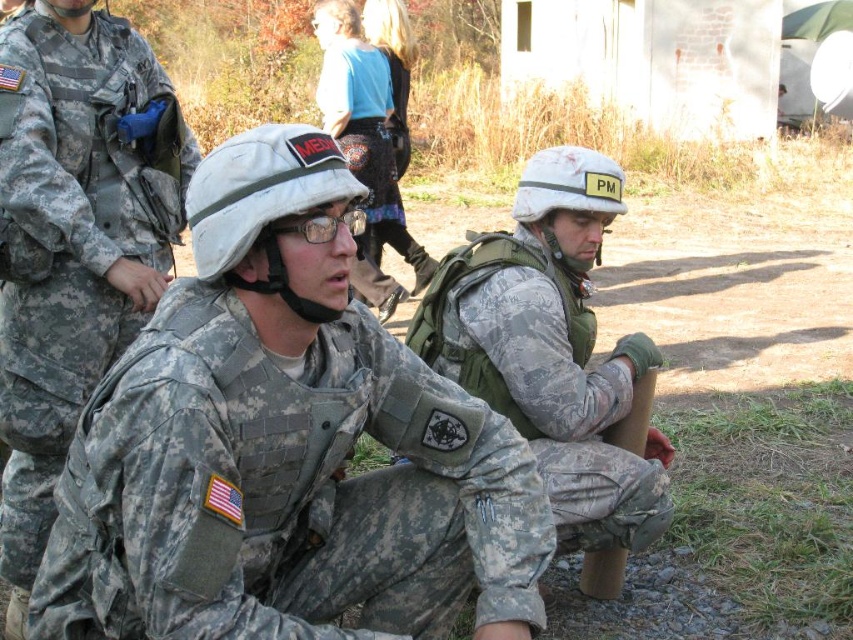
Who is positioned more to the left, blue denim skirt at center or brushed metal backpack at center?

blue denim skirt at center is more to the left.

Between blue denim skirt at center and brushed metal backpack at center, which one has less height?

With less height is brushed metal backpack at center.

Which is behind, point (403, 19) or point (401, 172)?

The point (401, 172) is behind.

Locate an element on the screen. blue denim skirt at center is located at coordinates (395, 132).

The height and width of the screenshot is (640, 853). What do you see at coordinates (74, 240) in the screenshot?
I see `camouflage uniform at center` at bounding box center [74, 240].

Which of these two, camouflage uniform at center or camouflage fabric helmet at center, stands taller?

camouflage uniform at center is taller.

Does point (160, 109) lie in front of point (558, 224)?

Yes, it is in front of point (558, 224).

The height and width of the screenshot is (640, 853). Find the location of `camouflage uniform at center`. camouflage uniform at center is located at coordinates (74, 240).

What do you see at coordinates (270, 483) in the screenshot? I see `camouflage fabric uniform at center` at bounding box center [270, 483].

Is camouflage fabric uniform at center wider than camouflage fabric helmet at center?

Yes, camouflage fabric uniform at center is wider than camouflage fabric helmet at center.

Does point (379, 333) come closer to viewer compared to point (616, 355)?

Yes.

Where is `camouflage fabric uniform at center`? camouflage fabric uniform at center is located at coordinates (270, 483).